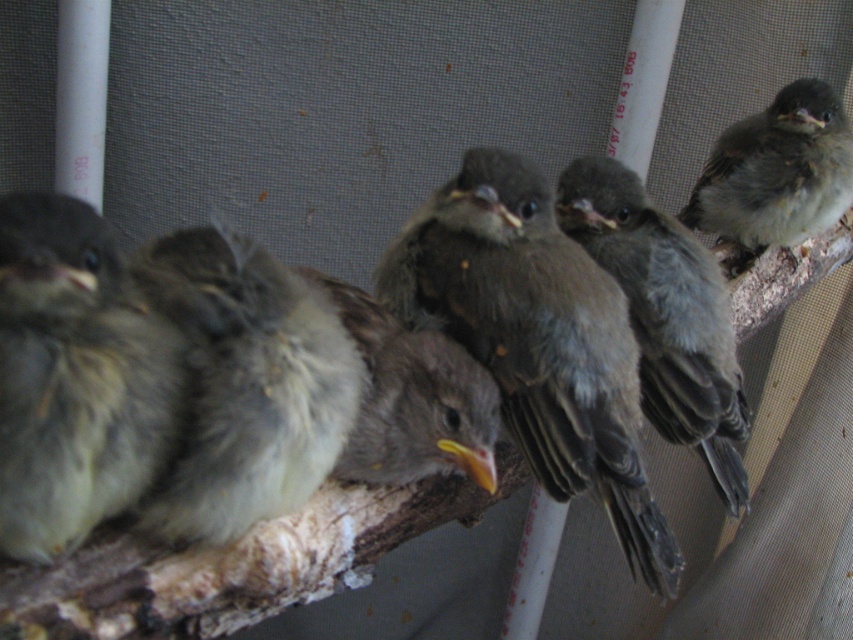
You are a birdwatcher observing two brown fluffy birds in the scene. Which of the two birds, the brown fluffy bird at center or the brown fluffy bird at upper right, is taller?

The brown fluffy bird at upper right is taller than the brown fluffy bird at center.

You are a birdwatcher holding a camera 4 feet away from the wooden branch. You want to take a closeup photo of the brown feathered bird at center. Is the bird within your camera range?

The brown feathered bird at center is 3.50 feet from viewer, so yes, the bird is within the camera range since it is closer than 4 feet.

You are a bird watcher observing the scene. You notice the gray downy feathers at center and the brown fluffy bird at upper right. Which object is wider in size?

The brown fluffy bird at upper right is wider than the gray downy feathers at center.